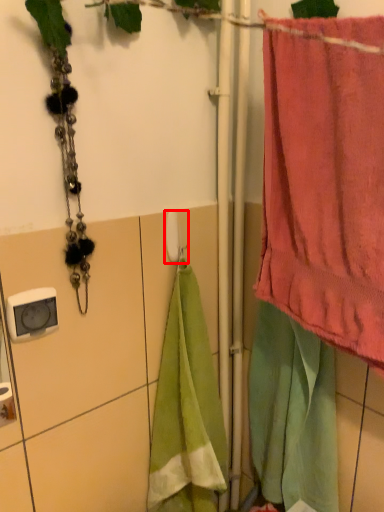
Question: Where is towel bar (annotated by the red box) located in relation to towel in the image?

Choices:
 (A) left
 (B) right

Answer: (A)